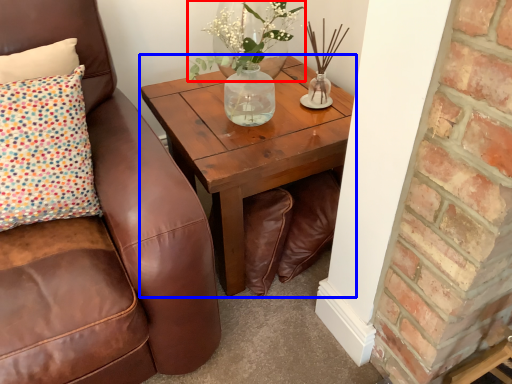
Question: Which of the following is the closest to the observer, floral arrangement (highlighted by a red box) or coffee table (highlighted by a blue box)?

Choices:
 (A) floral arrangement
 (B) coffee table

Answer: (B)